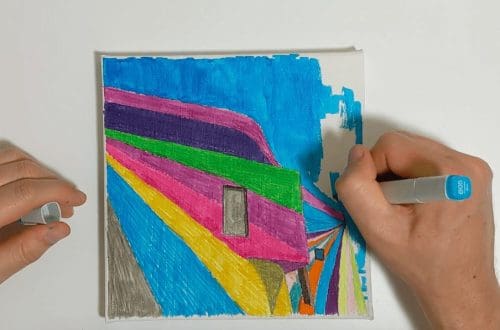
Locate an element on the screen. Image resolution: width=500 pixels, height=330 pixels. white table is located at coordinates (436, 56).